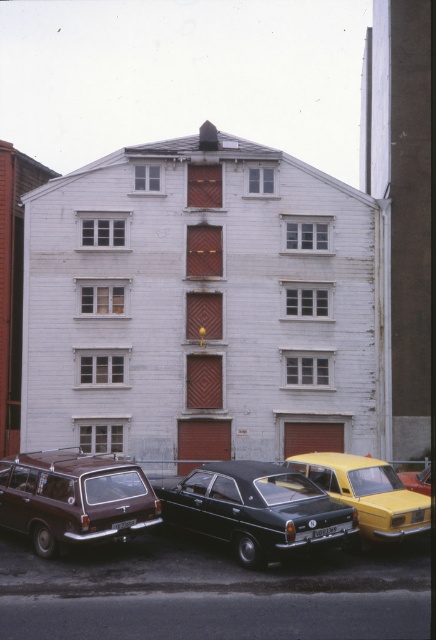
Between brown matte station wagon at lower left and yellow matte car at lower right, which one has more height?

Standing taller between the two is brown matte station wagon at lower left.

Which is in front, point (92, 460) or point (425, 492)?

Positioned in front is point (92, 460).

Which is in front, point (71, 474) or point (398, 474)?

Point (71, 474) is in front.

Identify the location of brown matte station wagon at lower left. (74, 499).

Image resolution: width=436 pixels, height=640 pixels. What do you see at coordinates (255, 509) in the screenshot?
I see `shiny black sedan at center` at bounding box center [255, 509].

Between point (265, 512) and point (139, 467), which one is positioned behind?

The point (139, 467) is more distant.

Identify the location of shiny black sedan at center. (255, 509).

Based on the photo, does yellow matte car at center have a greater width compared to yellow matte car at lower right?

No.

Is point (422, 518) in front of point (429, 483)?

Yes, it is.

Does point (319, 484) lie behind point (426, 493)?

That is False.

This screenshot has height=640, width=436. What are the coordinates of `yellow matte car at center` in the screenshot? It's located at (367, 492).